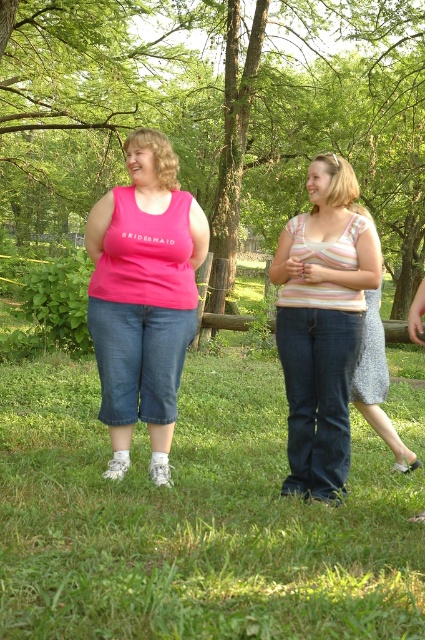
Which is behind, point (300, 92) or point (370, 356)?

Point (300, 92)

Is green leafy tree at upper center positioned in front of speckled fabric dress at center?

That is False.

Is point (113, 64) closer to camera compared to point (374, 292)?

No, it is behind (374, 292).

The image size is (425, 640). Find the location of `green leafy tree at upper center`. green leafy tree at upper center is located at coordinates (240, 102).

Between matte pink tank top at center and striped cotton tank top at center, which one is positioned higher?

matte pink tank top at center is higher up.

At what (x,y) coordinates should I click in order to perform the action: click on matte pink tank top at center. Please return your answer as a coordinate pair (x, y). This screenshot has width=425, height=640. Looking at the image, I should click on (144, 298).

Can you confirm if matte pink tank top at center is thinner than speckled fabric dress at center?

In fact, matte pink tank top at center might be wider than speckled fabric dress at center.

Between matte pink tank top at center and speckled fabric dress at center, which one appears on the right side from the viewer's perspective?

speckled fabric dress at center

Is point (166, 476) less distant than point (382, 330)?

That is True.

The image size is (425, 640). Find the location of `matte pink tank top at center`. matte pink tank top at center is located at coordinates (144, 298).